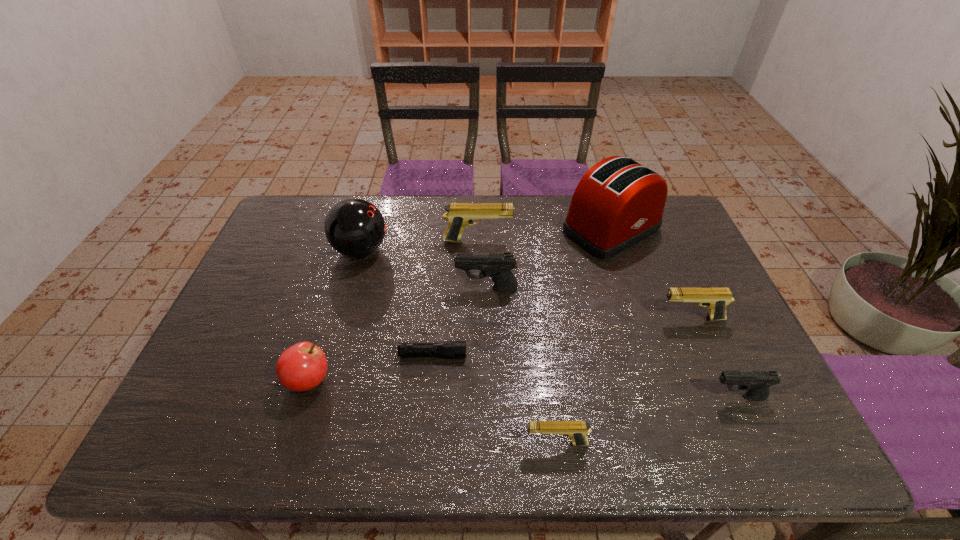
In the image, there is a desktop. Identify the location of vacant space at the far edge. (495, 224).

At what (x,y) coordinates should I click in order to perform the action: click on vacant space at the near edge of the desktop. Please return your answer as a coordinate pair (x, y). The height and width of the screenshot is (540, 960). Looking at the image, I should click on (329, 458).

What are the coordinates of `vacant point at the left edge` in the screenshot? It's located at (258, 318).

The image size is (960, 540). In the image, there is a desktop. Identify the location of vacant space at the right edge. (726, 354).

Where is `vacant space at the far left corner of the desktop`? This screenshot has width=960, height=540. vacant space at the far left corner of the desktop is located at coordinates (279, 221).

What are the coordinates of `vacant area at the near right corner of the desktop` in the screenshot? It's located at (738, 436).

I want to click on free space between the nearest object and the second nearest pistol, so click(x=647, y=420).

You are a GUI agent. You are given a task and a screenshot of the screen. Output one action in this format:
    pyautogui.click(x=<x>, y=<y>)
    Task: Click on the free area in between the biggest tan pistol and the shortest object
    
    Given the screenshot: What is the action you would take?
    pyautogui.click(x=455, y=298)

Locate an element on the screen. empty location between the apple and the second nearest pistol is located at coordinates (523, 389).

Where is `vacant area that lies between the shortest pistol and the red toaster`? Image resolution: width=960 pixels, height=540 pixels. vacant area that lies between the shortest pistol and the red toaster is located at coordinates (584, 336).